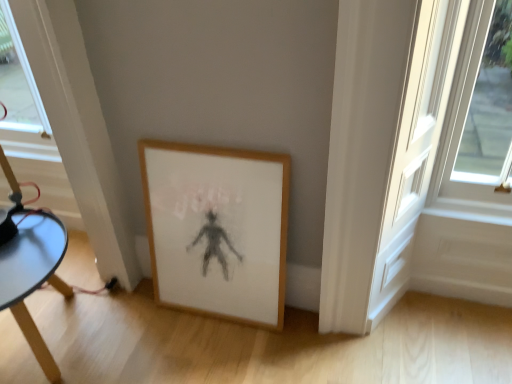
This screenshot has height=384, width=512. What are the coordinates of `wooden picture frame at lower center` in the screenshot? It's located at (217, 229).

The height and width of the screenshot is (384, 512). What do you see at coordinates (217, 229) in the screenshot?
I see `wooden picture frame at lower center` at bounding box center [217, 229].

What do you see at coordinates (33, 275) in the screenshot?
I see `wooden table at lower left` at bounding box center [33, 275].

This screenshot has width=512, height=384. Find the location of `wooden table at lower left`. wooden table at lower left is located at coordinates pos(33,275).

What is the approximate width of wooden table at lower left?

The width of wooden table at lower left is 19.92 inches.

This screenshot has width=512, height=384. Identify the location of wooden picture frame at lower center. (217, 229).

Considering the relative positions of wooden table at lower left and wooden picture frame at lower center in the image provided, is wooden table at lower left to the left of wooden picture frame at lower center from the viewer's perspective?

Correct, you'll find wooden table at lower left to the left of wooden picture frame at lower center.

Is wooden table at lower left closer to camera compared to wooden picture frame at lower center?

Yes, it is in front of wooden picture frame at lower center.

Considering the points (14, 242) and (284, 271), which point is in front, point (14, 242) or point (284, 271)?

Point (14, 242)

From the image's perspective, between wooden table at lower left and wooden picture frame at lower center, who is located below?

wooden table at lower left appears lower in the image.

From a real-world perspective, is wooden table at lower left located beneath wooden picture frame at lower center?

Correct, in the physical world, wooden table at lower left is lower than wooden picture frame at lower center.

Considering the sizes of objects wooden table at lower left and wooden picture frame at lower center in the image provided, who is wider, wooden table at lower left or wooden picture frame at lower center?

wooden table at lower left.

Considering the sizes of wooden table at lower left and wooden picture frame at lower center in the image, is wooden table at lower left taller or shorter than wooden picture frame at lower center?

Clearly, wooden table at lower left is shorter compared to wooden picture frame at lower center.

Who is bigger, wooden table at lower left or wooden picture frame at lower center?

wooden table at lower left.

Can wooden picture frame at lower center be found inside wooden table at lower left?

No, wooden table at lower left does not contain wooden picture frame at lower center.

Are wooden table at lower left and wooden picture frame at lower center located far from each other?

wooden table at lower left is actually quite close to wooden picture frame at lower center.

Is wooden table at lower left looking in the opposite direction of wooden picture frame at lower center?

No, wooden table at lower left's orientation is not away from wooden picture frame at lower center.

Measure the distance from wooden table at lower left to wooden picture frame at lower center.

The distance of wooden table at lower left from wooden picture frame at lower center is 19.81 inches.

Where is `picture frame above the wooden table at lower left (from the image's perspective)`? The height and width of the screenshot is (384, 512). picture frame above the wooden table at lower left (from the image's perspective) is located at coordinates (x=217, y=229).

Considering the positions of objects wooden picture frame at lower center and wooden table at lower left in the image provided, who is more to the left, wooden picture frame at lower center or wooden table at lower left?

wooden table at lower left.

Is wooden picture frame at lower center further to camera compared to wooden table at lower left?

Yes, wooden picture frame at lower center is behind wooden table at lower left.

Does point (238, 295) lie in front of point (1, 288)?

That is False.

From the image's perspective, which object appears higher, wooden picture frame at lower center or wooden table at lower left?

wooden picture frame at lower center appears higher in the image.

From a real-world perspective, is wooden picture frame at lower center physically above wooden table at lower left?

Indeed, from a real-world perspective, wooden picture frame at lower center stands above wooden table at lower left.

Which of these two, wooden picture frame at lower center or wooden table at lower left, is wider?

wooden table at lower left.

Is wooden picture frame at lower center taller or shorter than wooden table at lower left?

In the image, wooden picture frame at lower center appears to be taller than wooden table at lower left.

Which of these two, wooden picture frame at lower center or wooden table at lower left, is bigger?

Bigger between the two is wooden table at lower left.

Is wooden picture frame at lower center not within wooden table at lower left?

Yes.

Is wooden picture frame at lower center touching wooden table at lower left?

No, wooden picture frame at lower center is not next to wooden table at lower left.

Could you tell me if wooden picture frame at lower center is facing wooden table at lower left?

No.

Can you tell me how much wooden picture frame at lower center and wooden table at lower left differ in facing direction?

wooden picture frame at lower center and wooden table at lower left are facing 0.932 degrees away from each other.

How distant is wooden picture frame at lower center from wooden table at lower left?

wooden picture frame at lower center is 19.81 inches away from wooden table at lower left.

The height and width of the screenshot is (384, 512). I want to click on table in front of the wooden picture frame at lower center, so click(33, 275).

Image resolution: width=512 pixels, height=384 pixels. Identify the location of picture frame behind the wooden table at lower left. (217, 229).

Locate an element on the screen. picture frame that is on the right side of wooden table at lower left is located at coordinates (217, 229).